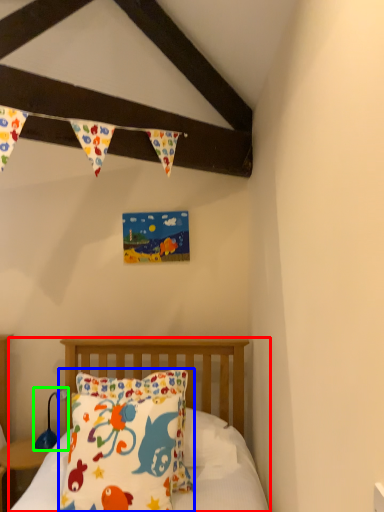
Question: Which object is positioned closest to bed (highlighted by a red box)? Select from pillow (highlighted by a blue box) and lamp (highlighted by a green box).

Choices:
 (A) pillow
 (B) lamp

Answer: (B)